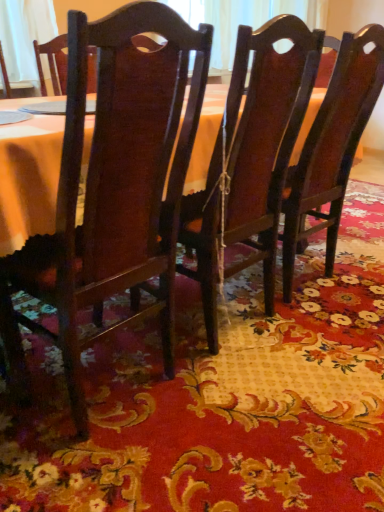
Where is `vacant area in front of glossy wood chair at center, which is counted as the third chair, starting from the left`? This screenshot has height=512, width=384. vacant area in front of glossy wood chair at center, which is counted as the third chair, starting from the left is located at coordinates (329, 333).